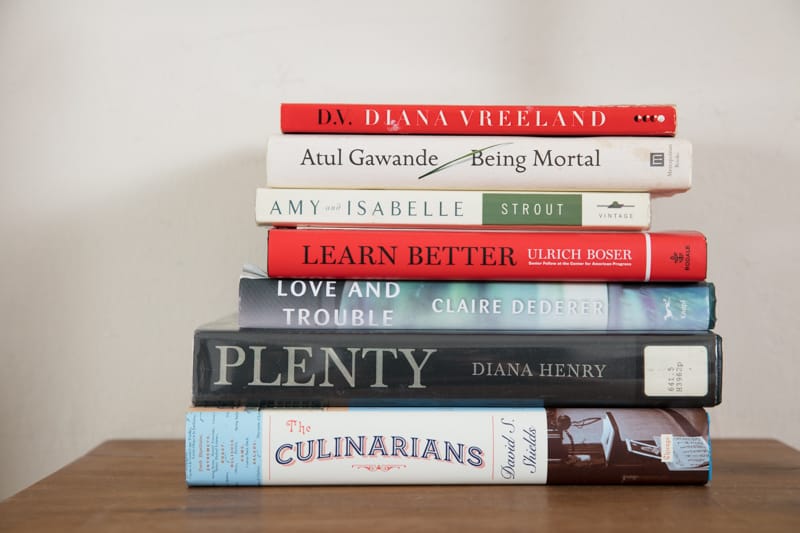
What are the coordinates of `books that don't have red spines` in the screenshot? It's located at (436, 450), (426, 377), (422, 314), (416, 208), (414, 164).